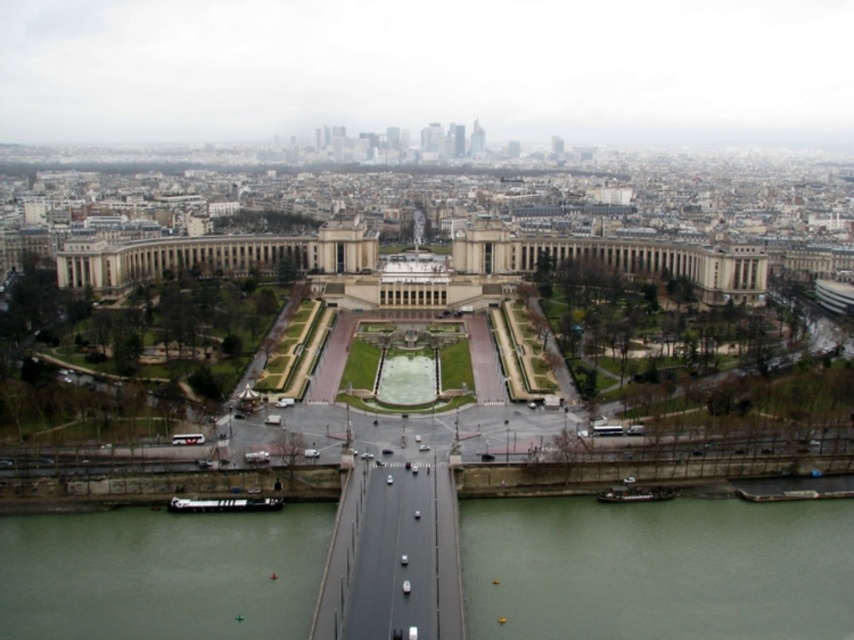
Question: Considering the relative positions of green water at lower left and concrete bridge at lower center in the image provided, where is green water at lower left located with respect to concrete bridge at lower center?

Choices:
 (A) above
 (B) below

Answer: (B)

Question: Can you confirm if green water at lower right is smaller than concrete bridge at lower center?

Choices:
 (A) no
 (B) yes

Answer: (A)

Question: Among these objects, which one is farthest from the camera?

Choices:
 (A) concrete bridge at lower center
 (B) green water at lower left

Answer: (A)

Question: Can you confirm if green water at lower left is thinner than clear glass waterway at center?

Choices:
 (A) yes
 (B) no

Answer: (B)

Question: Which of the following is the closest to the observer?

Choices:
 (A) concrete bridge at lower center
 (B) clear glass waterway at center
 (C) green water at lower right

Answer: (C)

Question: Which point is closer to the camera?

Choices:
 (A) (794, 465)
 (B) (711, 620)

Answer: (B)